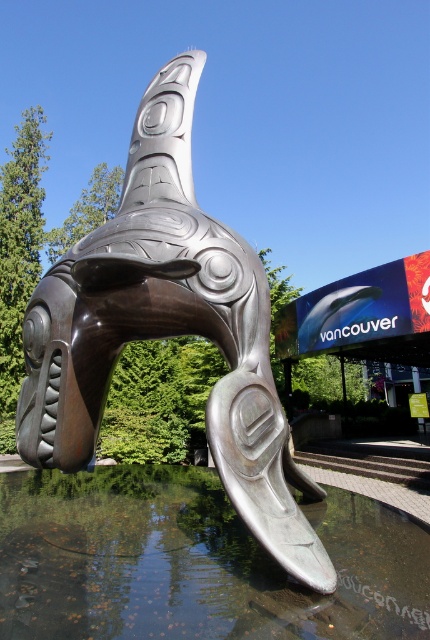
Does shiny bronze orca at center appear under glossy reflective water at lower center?

Actually, shiny bronze orca at center is above glossy reflective water at lower center.

Does shiny bronze orca at center have a greater height compared to glossy reflective water at lower center?

Yes.

Is point (111, 301) farther from viewer compared to point (104, 573)?

Yes, it is.

This screenshot has height=640, width=430. In order to click on shiny bronze orca at center in this screenshot , I will do `click(168, 330)`.